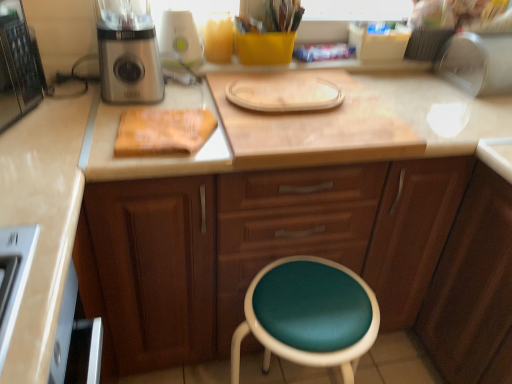
The image size is (512, 384). Find the location of `free spot above teal leather stool at lower center (from a real-world perspective)`. free spot above teal leather stool at lower center (from a real-world perspective) is located at coordinates (315, 308).